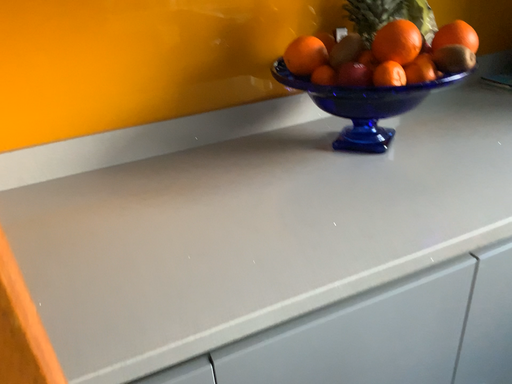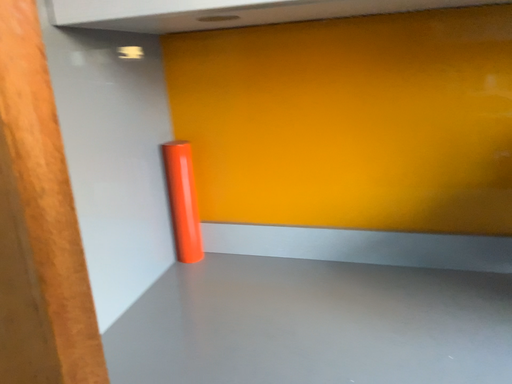
Question: Which way did the camera rotate in the video?

Choices:
 (A) rotated upward
 (B) rotated downward

Answer: (A)